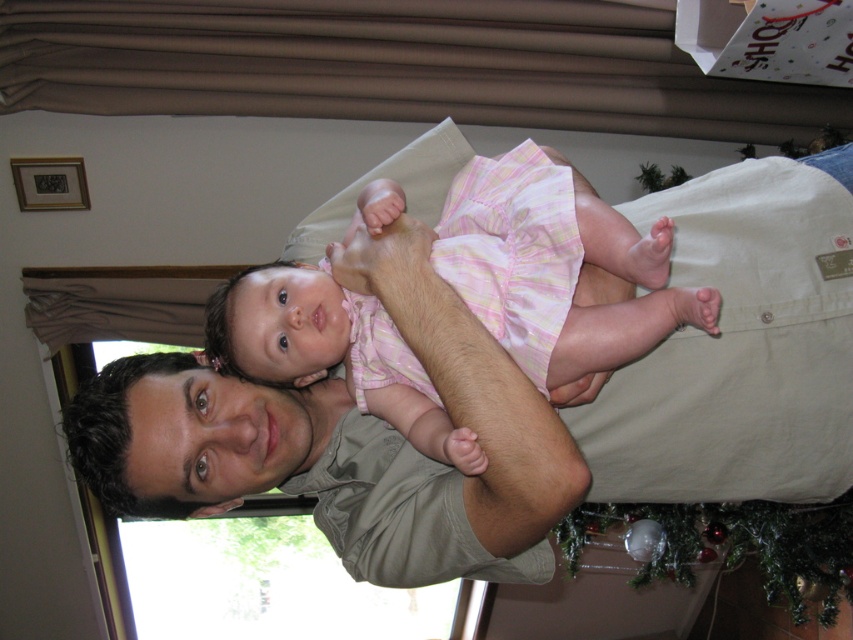
Question: Which of the following is the farthest from the observer?

Choices:
 (A) (849, 284)
 (B) (271, 262)

Answer: (A)

Question: Which of the following is the closest to the observer?

Choices:
 (A) pink plaid dress at center
 (B) matte khaki shirt at center

Answer: (A)

Question: Can you confirm if matte khaki shirt at center is positioned above pink plaid dress at center?

Choices:
 (A) no
 (B) yes

Answer: (A)

Question: Can you confirm if matte khaki shirt at center is positioned to the right of pink plaid dress at center?

Choices:
 (A) yes
 (B) no

Answer: (A)

Question: Does matte khaki shirt at center have a smaller size compared to pink plaid dress at center?

Choices:
 (A) no
 (B) yes

Answer: (A)